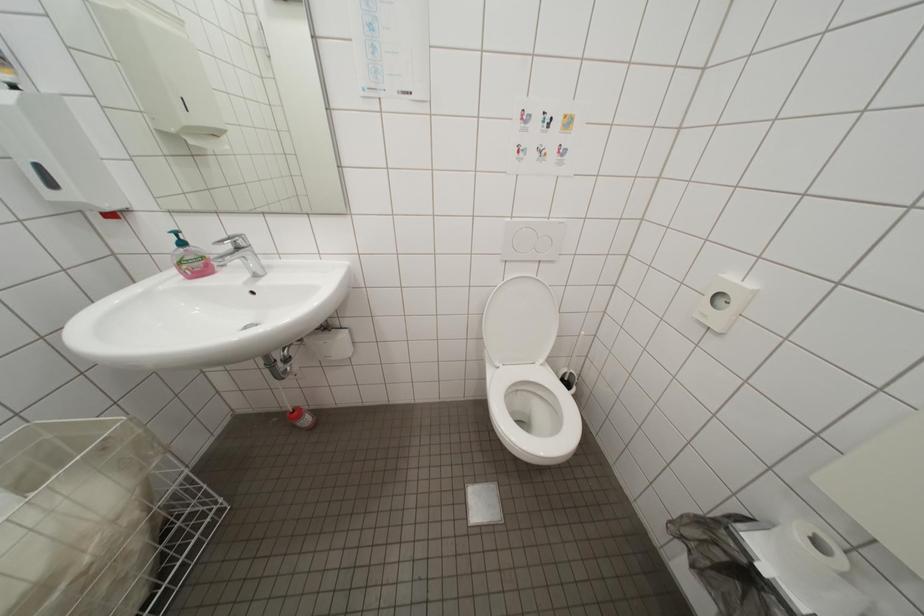
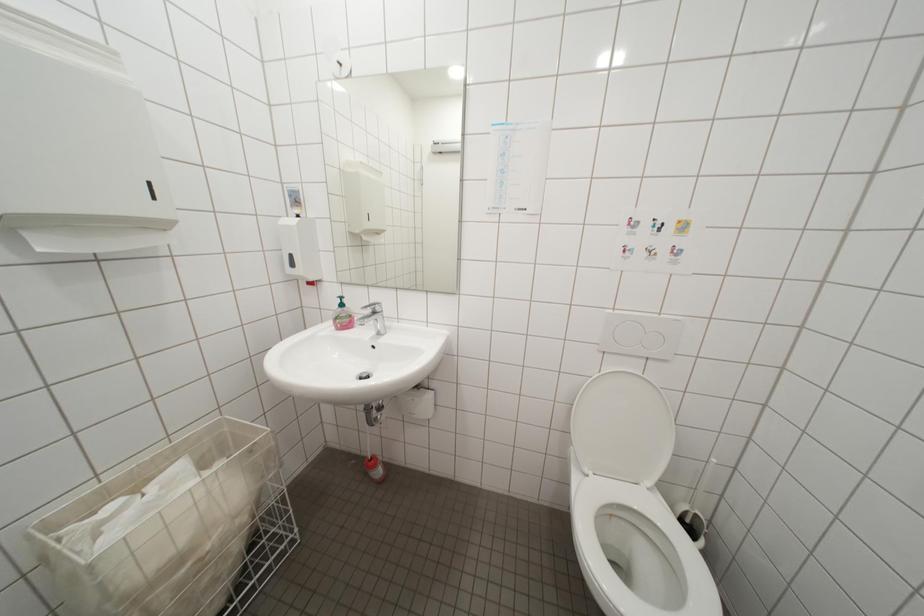
Question: The camera is either moving clockwise (left) or counter-clockwise (right) around the object. The first image is from the beginning of the video and the second image is from the end. Is the camera moving left or right when shooting the video?

Choices:
 (A) Left
 (B) Right

Answer: (B)